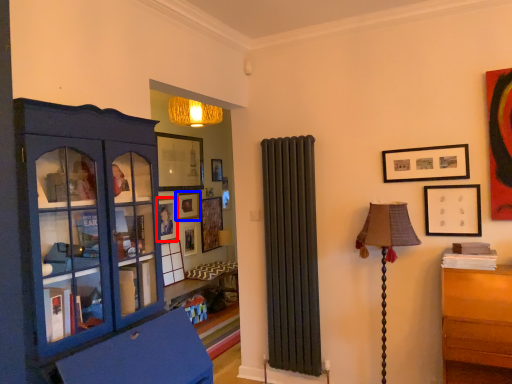
Question: Which object is further to the camera taking this photo, picture frame (highlighted by a red box) or picture frame (highlighted by a blue box)?

Choices:
 (A) picture frame
 (B) picture frame

Answer: (B)